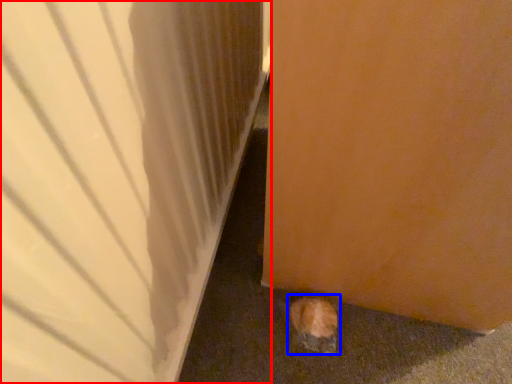
Question: Which point is closer to the camera, door (highlighted by a red box) or animal (highlighted by a blue box)?

Choices:
 (A) door
 (B) animal

Answer: (A)